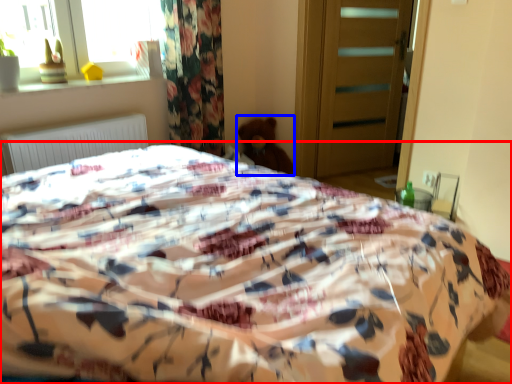
Question: Which object is closer to the camera taking this photo, bed (highlighted by a red box) or teddy (highlighted by a blue box)?

Choices:
 (A) bed
 (B) teddy

Answer: (A)